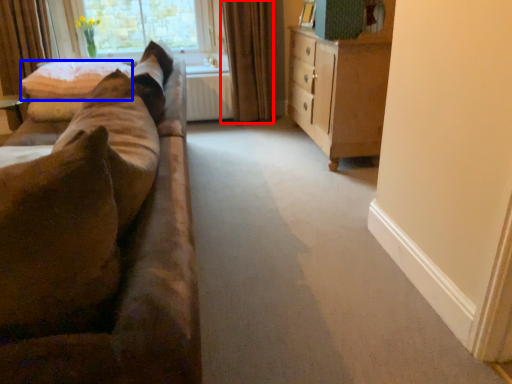
Question: Which point is further to the camera, curtain (highlighted by a red box) or pillow (highlighted by a blue box)?

Choices:
 (A) curtain
 (B) pillow

Answer: (A)